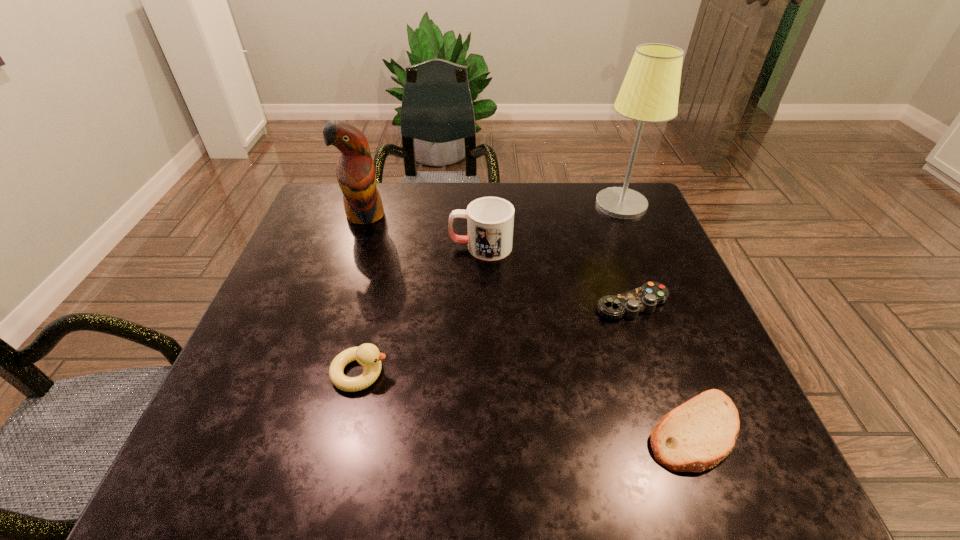
At what (x,y) coordinates should I click in order to perform the action: click on vacant point located 0.400m on the side of the third tallest object with the handle. Please return your answer as a coordinate pair (x, y). Image resolution: width=960 pixels, height=540 pixels. Looking at the image, I should click on (294, 246).

Where is `vacant area situated 0.350m on the side of the third tallest object with the handle`? The height and width of the screenshot is (540, 960). vacant area situated 0.350m on the side of the third tallest object with the handle is located at coordinates (313, 246).

The width and height of the screenshot is (960, 540). I want to click on vacant space located 0.160m at the beak of the duckling, so click(472, 373).

Find the location of a particular element. The height and width of the screenshot is (540, 960). free location located 0.320m on the back of the fourth farthest object is located at coordinates (599, 210).

At what (x,y) coordinates should I click in order to perform the action: click on vacant region located on the left of the pita bread. Please return your answer as a coordinate pair (x, y). Image resolution: width=960 pixels, height=540 pixels. Looking at the image, I should click on (558, 430).

The image size is (960, 540). Find the location of `table lamp that is positioned at the far edge`. table lamp that is positioned at the far edge is located at coordinates (650, 91).

You are a GUI agent. You are given a task and a screenshot of the screen. Output one action in this format:
    pyautogui.click(x=<x>, y=<y>)
    Task: Click on the parrot that is at the far edge
    
    Given the screenshot: What is the action you would take?
    pyautogui.click(x=356, y=174)

The image size is (960, 540). I want to click on object at the near edge, so click(x=696, y=436).

The height and width of the screenshot is (540, 960). In order to click on object that is at the left edge in this screenshot , I will do click(x=356, y=174).

Find the location of `table lamp situated at the right edge`. table lamp situated at the right edge is located at coordinates (650, 91).